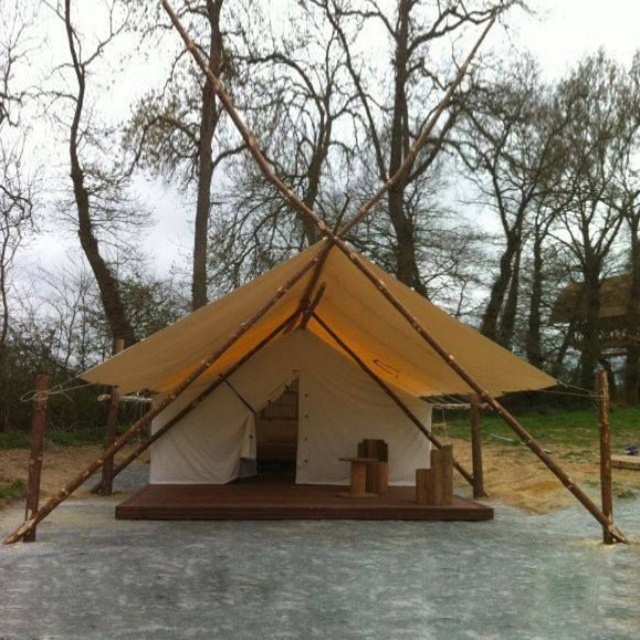
Where is `brown wooden pole at center`? This screenshot has width=640, height=640. brown wooden pole at center is located at coordinates (515, 173).

Can you confirm if brown wooden pole at center is smaller than beige canvas tent at center?

No.

Is point (134, 0) farther from viewer compared to point (180, 406)?

Yes, it is.

At what (x,y) coordinates should I click in order to perform the action: click on brown wooden pole at center. Please return your answer as a coordinate pair (x, y). This screenshot has width=640, height=640. Looking at the image, I should click on (515, 173).